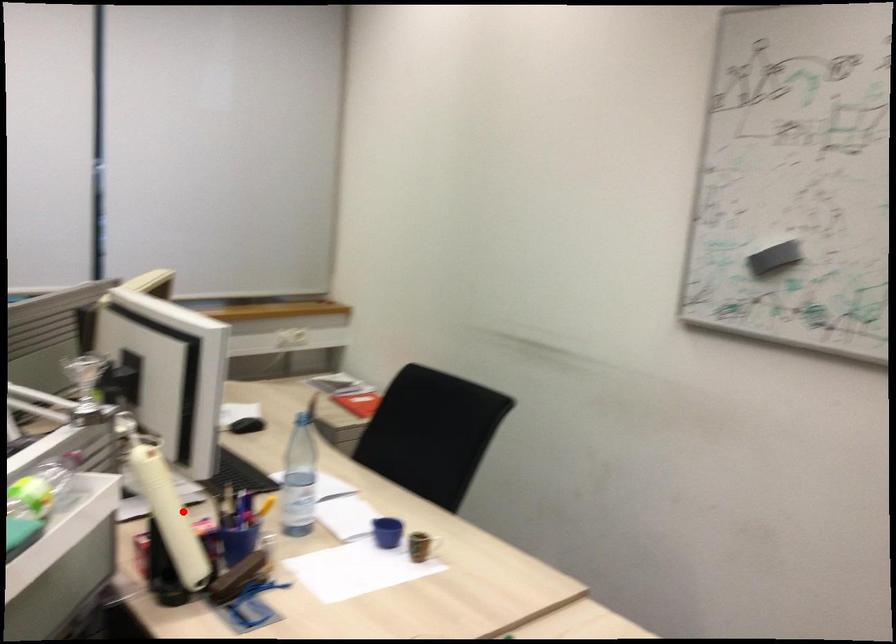
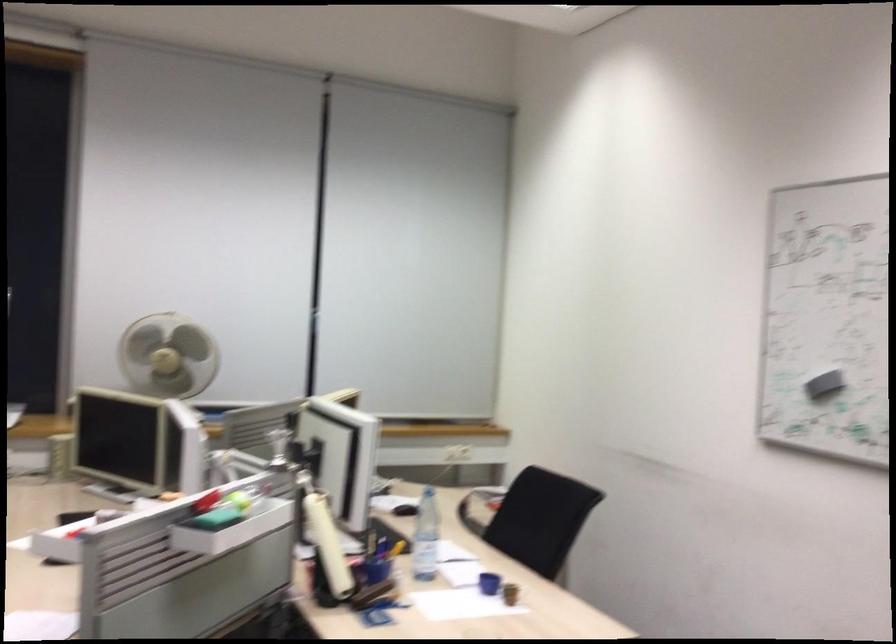
Find the pixel in the second image that matches the highlighted location in the first image.

(328, 545)